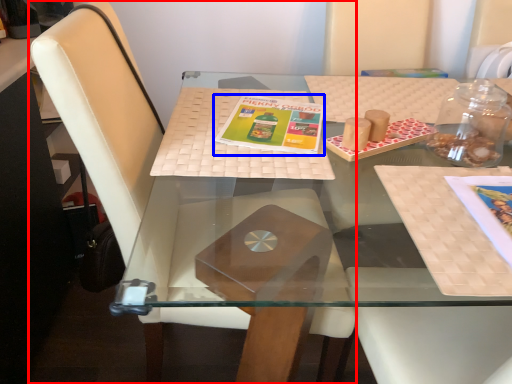
Question: Which of the following is the farthest to the observer, chair (highlighted by a red box) or book cover (highlighted by a blue box)?

Choices:
 (A) chair
 (B) book cover

Answer: (B)